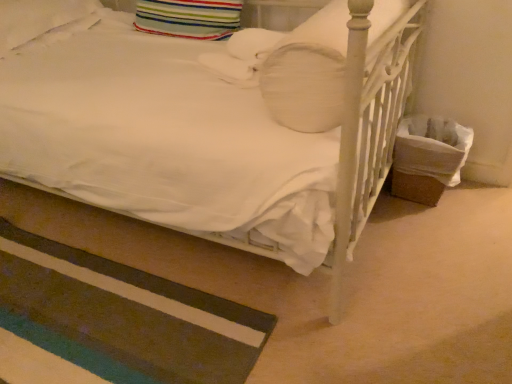
Question: From the image's perspective, relative to striped carpet at lower left, is striped fabric pillow at upper center, acting as the second pillow starting from the right, above or below?

Choices:
 (A) above
 (B) below

Answer: (A)

Question: From a real-world perspective, relative to striped carpet at lower left, is striped fabric pillow at upper center, acting as the second pillow starting from the right, vertically above or below?

Choices:
 (A) below
 (B) above

Answer: (B)

Question: Considering the real-world distances, which object is farthest from the white matte pillow at upper center, marked as the third pillow in a left-to-right arrangement?

Choices:
 (A) white soft pillow at upper left, which is counted as the 3th pillow, starting from the right
 (B) striped fabric pillow at upper center, placed as the second pillow when sorted from left to right
 (C) striped carpet at lower left

Answer: (A)

Question: Which object is positioned farthest from the white matte pillow at upper center, placed as the 1th pillow when sorted from right to left?

Choices:
 (A) white soft pillow at upper left, which is counted as the 3th pillow, starting from the right
 (B) striped carpet at lower left
 (C) striped fabric pillow at upper center, placed as the second pillow when sorted from left to right

Answer: (A)